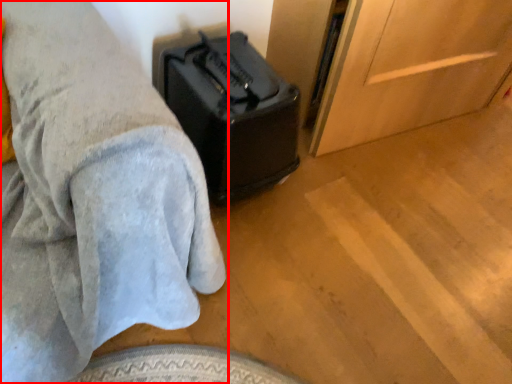
Question: In this image, where is furniture (annotated by the red box) located relative to luggage?

Choices:
 (A) right
 (B) left

Answer: (B)